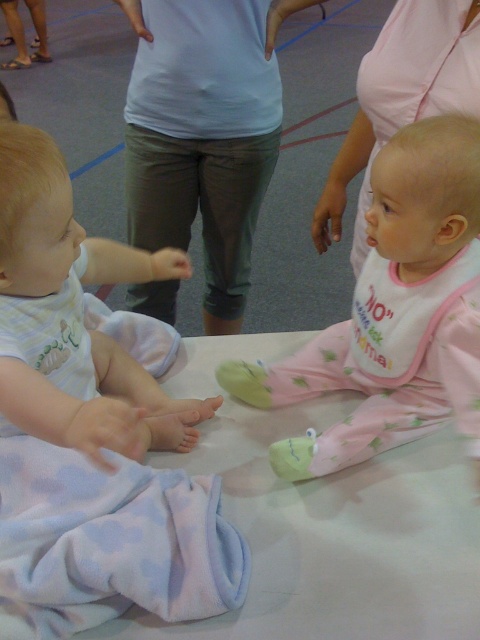
Does light blue fabric pants at center come in front of white fabric bib at center?

No, light blue fabric pants at center is behind white fabric bib at center.

Who is more forward, (x=233, y=90) or (x=445, y=296)?

Point (x=445, y=296) is more forward.

Between point (233, 212) and point (435, 314), which one is positioned in front?

Point (435, 314)

Identify the location of light blue fabric pants at center. (204, 132).

Between light blue fabric pants at center and pink fabric dress at upper center, which one has more height?

light blue fabric pants at center is taller.

Between light blue fabric pants at center and pink fabric dress at upper center, which one appears on the left side from the viewer's perspective?

light blue fabric pants at center is more to the left.

Who is more distant from viewer, [180,237] or [431,1]?

Point [180,237]

This screenshot has height=640, width=480. I want to click on light blue fabric pants at center, so click(204, 132).

Between pink cotton onesie at center and white fabric bib at center, which one appears on the left side from the viewer's perspective?

pink cotton onesie at center is more to the left.

Does pink cotton onesie at center lie in front of white fabric bib at center?

Yes, pink cotton onesie at center is in front of white fabric bib at center.

Is point (396, 429) positioned before point (397, 349)?

No, it is not.

At what (x,y) coordinates should I click in order to perform the action: click on pink cotton onesie at center. Please return your answer as a coordinate pair (x, y). The height and width of the screenshot is (640, 480). Looking at the image, I should click on (395, 310).